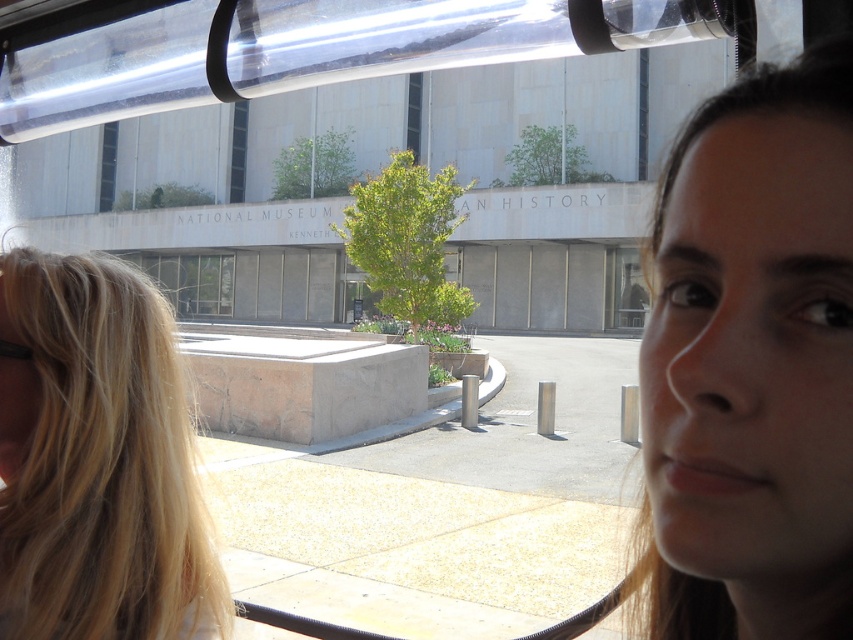
Question: Is blonde hair at left below clear glass window at center?

Choices:
 (A) yes
 (B) no

Answer: (A)

Question: Can you confirm if smooth skin face at upper right is thinner than clear glass window at center?

Choices:
 (A) no
 (B) yes

Answer: (B)

Question: Among these objects, which one is nearest to the camera?

Choices:
 (A) blonde hair at left
 (B) smooth skin face at upper right
 (C) clear glass window at center

Answer: (B)

Question: Which point is closer to the camera?

Choices:
 (A) smooth skin face at upper right
 (B) blonde hair at left

Answer: (A)

Question: Does smooth skin face at upper right have a smaller size compared to clear glass window at center?

Choices:
 (A) yes
 (B) no

Answer: (A)

Question: Which point is closer to the camera?

Choices:
 (A) (817, 282)
 (B) (618, 275)

Answer: (A)